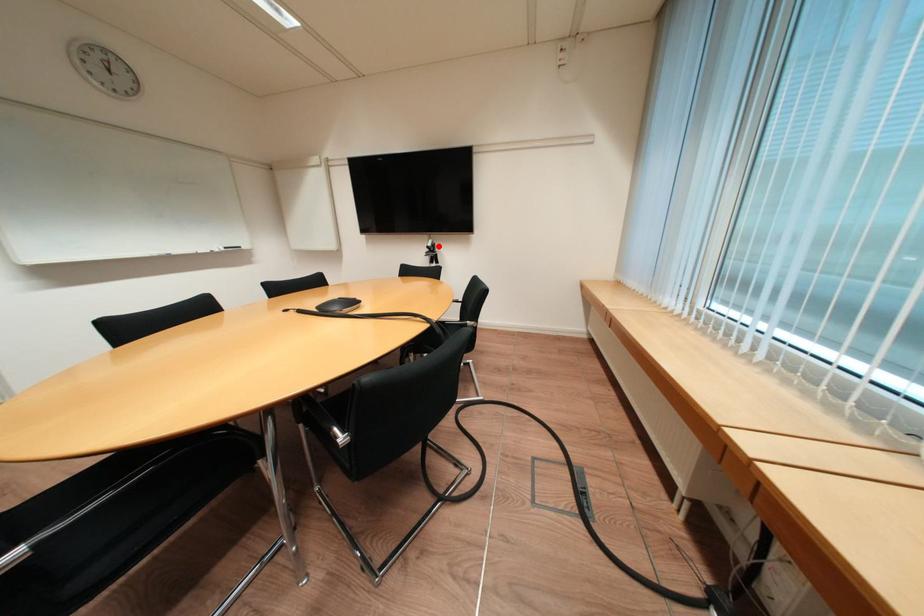
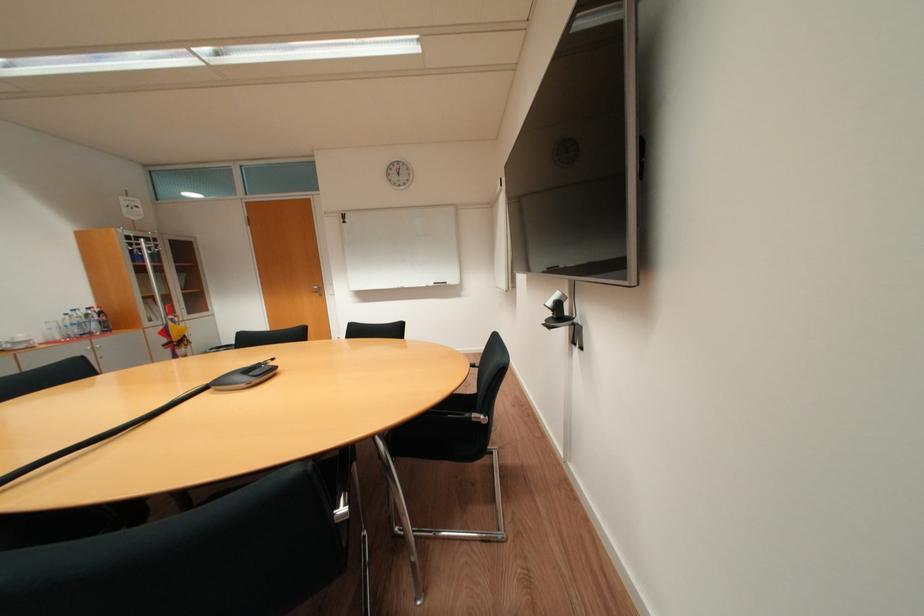
In the second image, find the point that corresponds to the highlighted location in the first image.

(558, 304)